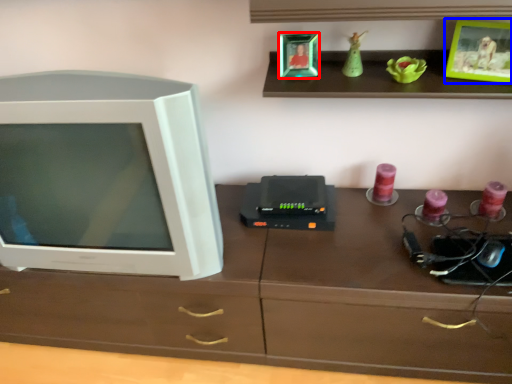
Question: Which object appears farthest to the camera in this image, picture frame (highlighted by a red box) or picture frame (highlighted by a blue box)?

Choices:
 (A) picture frame
 (B) picture frame

Answer: (A)